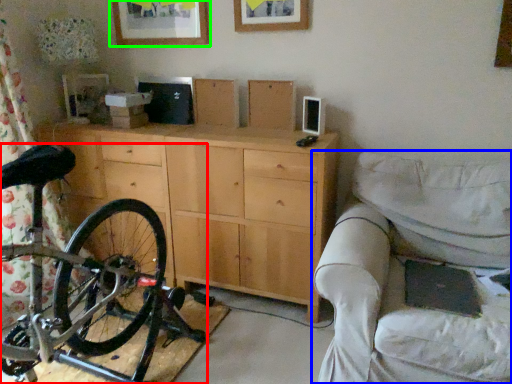
Question: Which is farther away from bicycle (highlighted by a red box)? studio couch (highlighted by a blue box) or picture frame (highlighted by a green box)?

Choices:
 (A) studio couch
 (B) picture frame

Answer: (B)